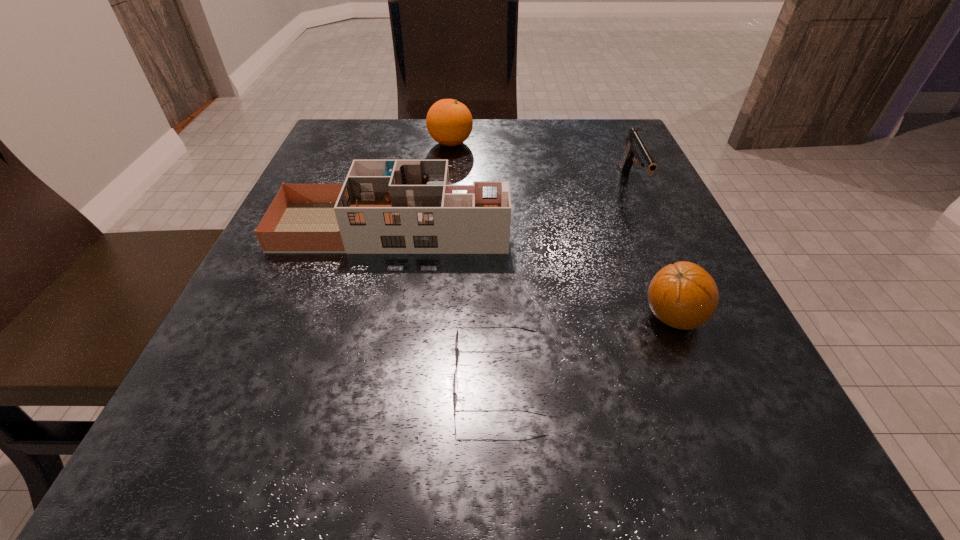
Identify the location of free space between the right orange and the shortest object. (586, 348).

At what (x,y) coordinates should I click in order to perform the action: click on vacant space that's between the pistol and the right orange. Please return your answer as a coordinate pair (x, y). The image size is (960, 540). Looking at the image, I should click on (653, 251).

Identify the location of vacant area that lies between the dollhouse and the pistol. This screenshot has height=540, width=960. (512, 206).

Where is `unoccupied position between the right orange and the dollhouse`? The height and width of the screenshot is (540, 960). unoccupied position between the right orange and the dollhouse is located at coordinates (533, 272).

Point out which object is positioned as the second nearest to the sunglasses. Please provide its 2D coordinates. Your answer should be formatted as a tuple, i.e. [(x, y)], where the tuple contains the x and y coordinates of a point satisfying the conditions above.

[(384, 206)]

Where is `object that ranks as the fourth closest to the shortest object`? object that ranks as the fourth closest to the shortest object is located at coordinates (449, 122).

I want to click on vacant space that satisfies the following two spatial constraints: 1. at the muzzle of the pistol; 2. on the front-facing side of the sunglasses, so point(720,380).

I want to click on free space that satisfies the following two spatial constraints: 1. at the front door of the right orange; 2. on the right side of the dollhouse, so [372, 317].

Locate an element on the screen. free space that satisfies the following two spatial constraints: 1. at the muzzle of the pistol; 2. at the front door of the dollhouse is located at coordinates (650, 227).

This screenshot has height=540, width=960. Find the location of `vacant space that satisfies the following two spatial constraints: 1. at the muzzle of the pistol; 2. at the front door of the dollhouse`. vacant space that satisfies the following two spatial constraints: 1. at the muzzle of the pistol; 2. at the front door of the dollhouse is located at coordinates (650, 227).